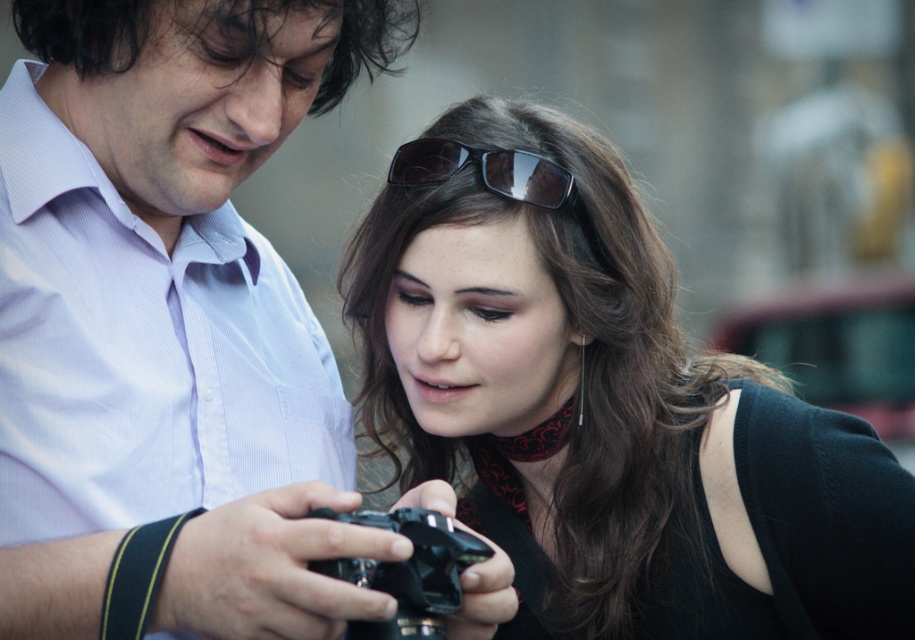
Is matte black hair at upper left behind black shiny sunglasses at upper center?

No, it is in front of black shiny sunglasses at upper center.

Can you confirm if matte black hair at upper left is positioned above black shiny sunglasses at upper center?

Yes, matte black hair at upper left is above black shiny sunglasses at upper center.

Who is more forward, (90, 36) or (418, 147)?

Point (90, 36)

The image size is (915, 640). What are the coordinates of `matte black hair at upper left` in the screenshot? It's located at (313, 33).

Who is shorter, matte white shirt at upper left or black plastic camera at center?

Standing shorter between the two is black plastic camera at center.

Does point (180, 339) come behind point (432, 609)?

Yes, point (180, 339) is farther from viewer.

Locate an element on the screen. The height and width of the screenshot is (640, 915). matte white shirt at upper left is located at coordinates (157, 248).

Which is above, matte black hair at upper left or black plastic camera at center?

matte black hair at upper left

Measure the distance from matte black hair at upper left to black plastic camera at center.

A distance of 7.91 meters exists between matte black hair at upper left and black plastic camera at center.

Where is `matte black hair at upper left`? matte black hair at upper left is located at coordinates (313, 33).

I want to click on matte black hair at upper left, so click(313, 33).